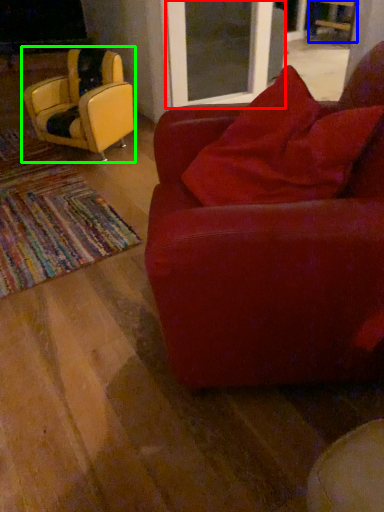
Question: Which is farther away from screen door (highlighted by a red box)? chair (highlighted by a blue box) or chair (highlighted by a green box)?

Choices:
 (A) chair
 (B) chair

Answer: (A)